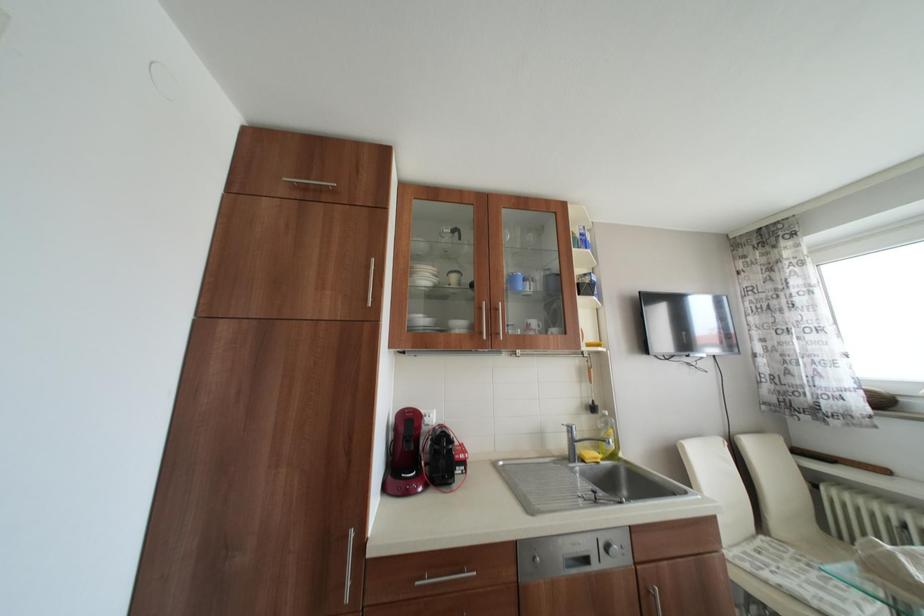
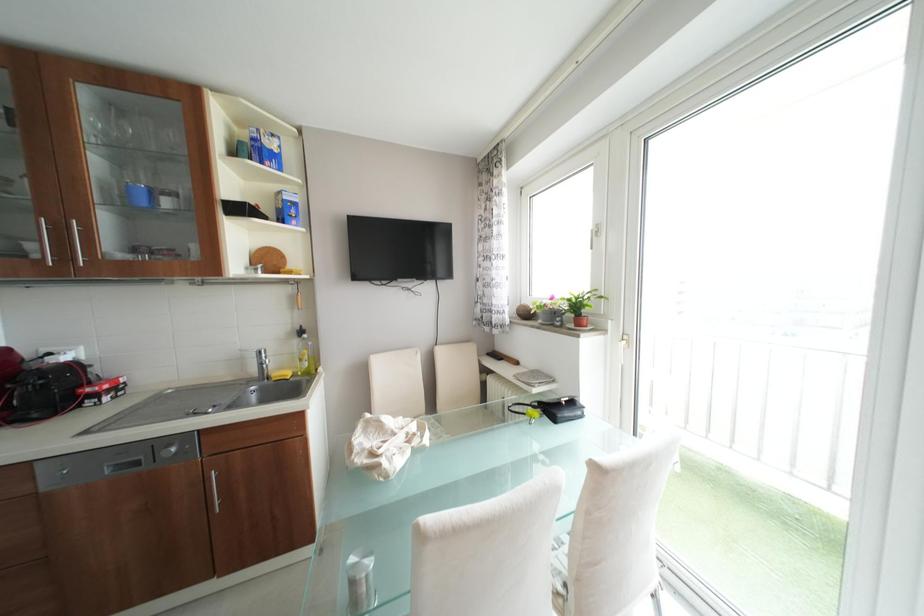
Question: Which direction would the cameraman need to move to produce the second image? Reply with the corresponding letter.

Choices:
 (A) Left
 (B) Right
 (C) Forward
 (D) Backward

Answer: (B)